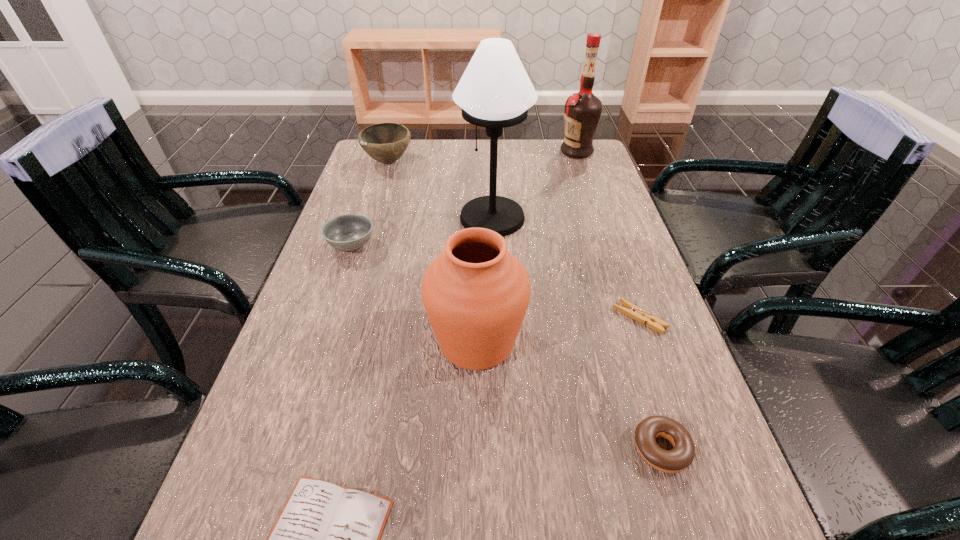
What are the coordinates of `free space located 0.060m on the front and back of the second tallest object` in the screenshot? It's located at tap(541, 151).

Where is `vacant space located on the front and back of the second tallest object`? The height and width of the screenshot is (540, 960). vacant space located on the front and back of the second tallest object is located at coordinates (468, 151).

This screenshot has width=960, height=540. What are the coordinates of `blank space located on the front and back of the second tallest object` in the screenshot? It's located at (450, 151).

At what (x,y) coordinates should I click in order to perform the action: click on vacant space located 0.100m on the back of the urn. Please return your answer as a coordinate pair (x, y). Image resolution: width=960 pixels, height=540 pixels. Looking at the image, I should click on (477, 275).

The height and width of the screenshot is (540, 960). Find the location of `vacant space located on the front of the fourth tallest object`. vacant space located on the front of the fourth tallest object is located at coordinates (377, 196).

Locate an element on the screen. vacant space located 0.050m on the front of the nearer bowl is located at coordinates (341, 276).

Where is `vacant region located 0.060m on the left of the sixth tallest object`? vacant region located 0.060m on the left of the sixth tallest object is located at coordinates 596,448.

At what (x,y) coordinates should I click in order to perform the action: click on free spot located on the back of the clothespin. Please return your answer as a coordinate pair (x, y). Looking at the image, I should click on (615, 249).

This screenshot has height=540, width=960. Find the location of `liquor that is at the far edge`. liquor that is at the far edge is located at coordinates (582, 112).

Where is `bowl at the far edge`? bowl at the far edge is located at coordinates click(386, 142).